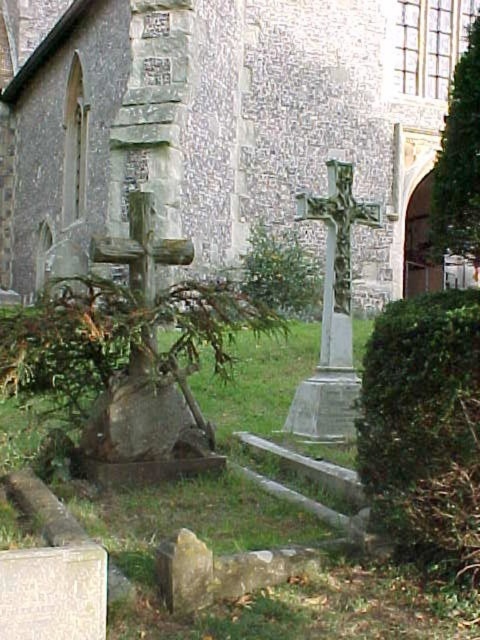
Which is behind, point (396, 275) or point (432, 252)?

The point (396, 275) is more distant.

In the scene shown: Can you confirm if stone church at center is taller than green leafy tree at upper right?

Indeed, stone church at center has a greater height compared to green leafy tree at upper right.

Who is more forward, (229, 244) or (434, 193)?

Point (434, 193) is more forward.

Where is `stone church at center`? The height and width of the screenshot is (640, 480). stone church at center is located at coordinates (216, 118).